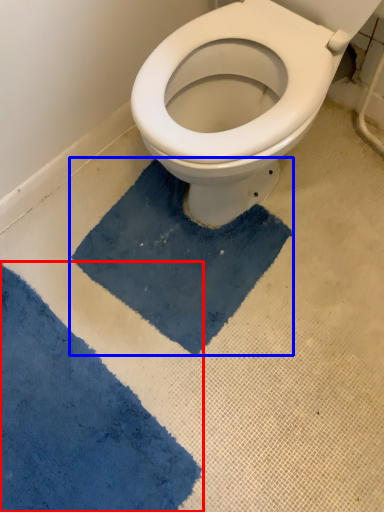
Question: Which point is closer to the camera, bath mat (highlighted by a red box) or bath mat (highlighted by a blue box)?

Choices:
 (A) bath mat
 (B) bath mat

Answer: (A)